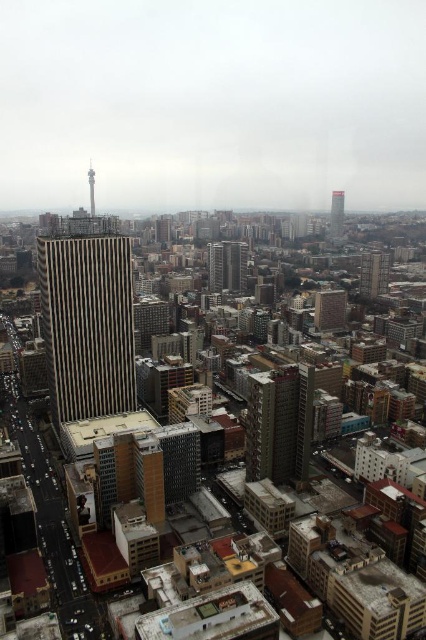
Does green glass skyscraper at center have a lesser height compared to smooth glass skyscraper at upper center?

Correct, green glass skyscraper at center is not as tall as smooth glass skyscraper at upper center.

Between green glass skyscraper at center and smooth glass skyscraper at upper center, which one has less height?

Standing shorter between the two is green glass skyscraper at center.

Is point (233, 289) closer to camera compared to point (337, 195)?

Yes, it is.

Where is `green glass skyscraper at center`? The width and height of the screenshot is (426, 640). green glass skyscraper at center is located at coordinates coord(227,266).

Does point (380, 266) come farther from viewer compared to point (337, 237)?

That is False.

Can you confirm if greenish-gray concrete building at upper right is taller than smooth glass skyscraper at upper center?

Correct, greenish-gray concrete building at upper right is much taller as smooth glass skyscraper at upper center.

I want to click on greenish-gray concrete building at upper right, so click(x=374, y=273).

How far apart are gold striped building at center and greenish-gray concrete building at upper right?

The distance of gold striped building at center from greenish-gray concrete building at upper right is 314.18 meters.

Does gold striped building at center have a lesser width compared to greenish-gray concrete building at upper right?

Correct, gold striped building at center's width is less than greenish-gray concrete building at upper right's.

Which is in front, point (91, 412) or point (374, 292)?

Positioned in front is point (91, 412).

What are the coordinates of `gold striped building at center` in the screenshot? It's located at (86, 323).